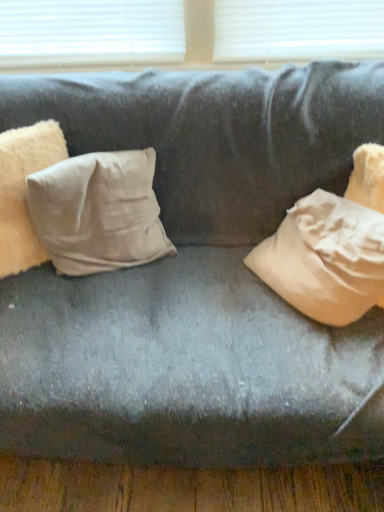
Question: Is beige cotton pillow at left, marked as the first pillow in a left-to-right arrangement, taller or shorter than beige cotton pillow at center-left, which is counted as the 1th pillow, starting from the right?

Choices:
 (A) tall
 (B) short

Answer: (A)

Question: From a real-world perspective, is beige cotton pillow at left, placed as the second pillow when sorted from right to left, above or below beige cotton pillow at center-left, which is counted as the 1th pillow, starting from the right?

Choices:
 (A) above
 (B) below

Answer: (A)

Question: From the image's perspective, is beige cotton pillow at left, placed as the second pillow when sorted from right to left, positioned above or below beige cotton pillow at center-left, which is the 2th pillow in left-to-right order?

Choices:
 (A) below
 (B) above

Answer: (B)

Question: Is beige cotton pillow at center-left, which is the 2th pillow in left-to-right order, wider or thinner than beige cotton pillow at left, marked as the first pillow in a left-to-right arrangement?

Choices:
 (A) wide
 (B) thin

Answer: (A)

Question: Considering their positions, is beige cotton pillow at center-left, which is counted as the 1th pillow, starting from the right, located in front of or behind beige cotton pillow at left, placed as the second pillow when sorted from right to left?

Choices:
 (A) behind
 (B) front

Answer: (A)

Question: From a real-world perspective, is beige cotton pillow at center-left, which is counted as the 1th pillow, starting from the right, above or below beige cotton pillow at left, placed as the second pillow when sorted from right to left?

Choices:
 (A) above
 (B) below

Answer: (B)

Question: Is beige cotton pillow at center-left, which is the 2th pillow in left-to-right order, bigger or smaller than beige cotton pillow at left, placed as the second pillow when sorted from right to left?

Choices:
 (A) small
 (B) big

Answer: (B)